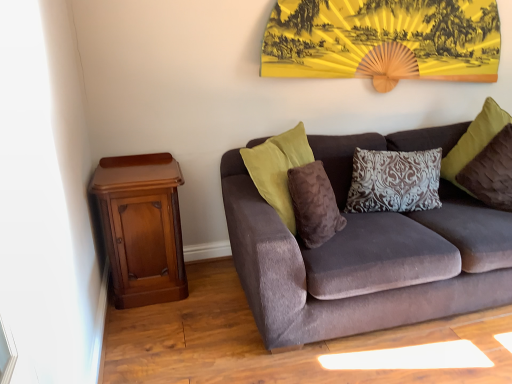
Locate an element on the screen. The width and height of the screenshot is (512, 384). vacant area that lies to the right of mahogany wood nightstand at left is located at coordinates (212, 292).